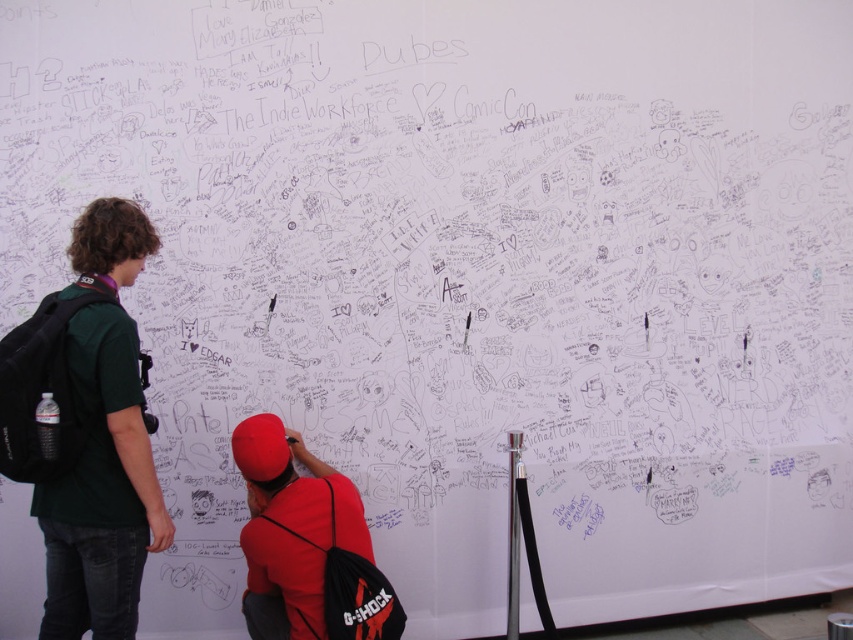
Question: Is green matte shirt at left above red fabric cap at center?

Choices:
 (A) no
 (B) yes

Answer: (B)

Question: Which point is closer to the camera?

Choices:
 (A) (352, 524)
 (B) (100, 442)

Answer: (B)

Question: Can you confirm if green matte shirt at left is positioned below red fabric cap at center?

Choices:
 (A) yes
 (B) no

Answer: (B)

Question: Which point appears closest to the camera in this image?

Choices:
 (A) (131, 636)
 (B) (251, 513)

Answer: (A)

Question: Does green matte shirt at left appear under red fabric cap at center?

Choices:
 (A) yes
 (B) no

Answer: (B)